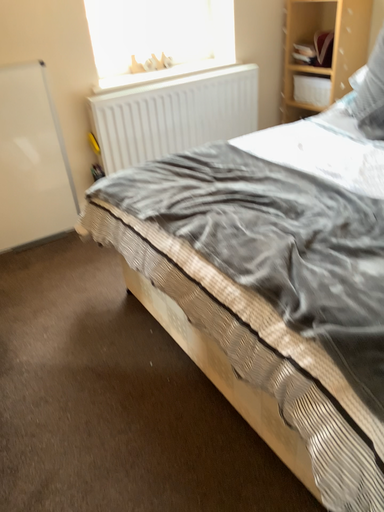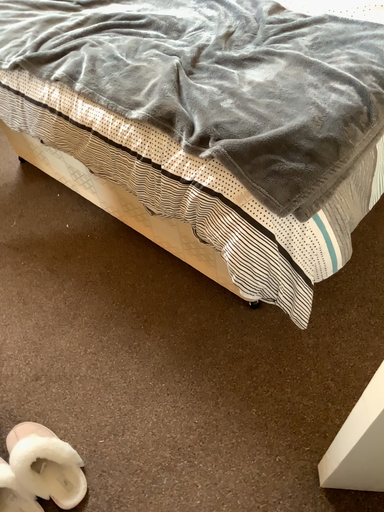
Question: How did the camera likely rotate when shooting the video?

Choices:
 (A) rotated upward
 (B) rotated downward

Answer: (B)